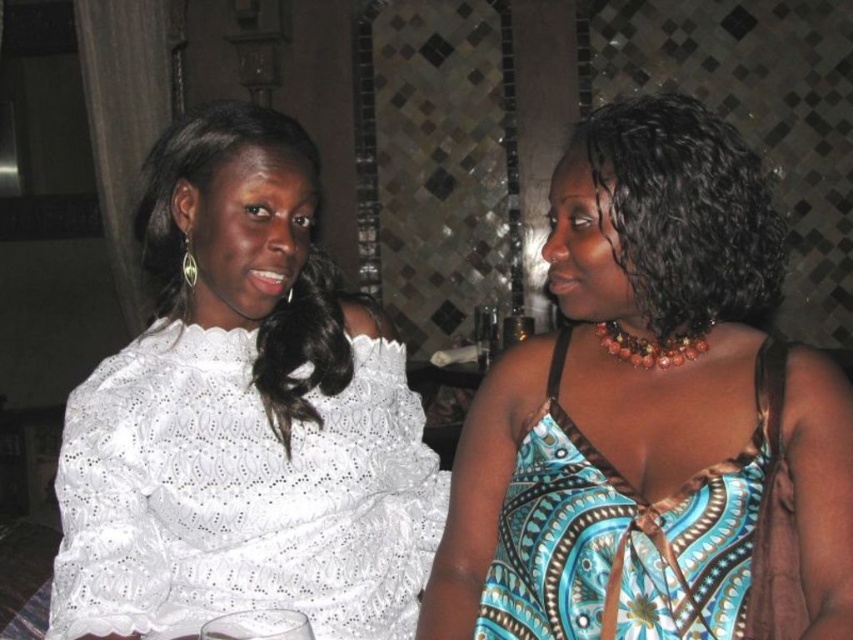
Between blue printed dress at center and blue printed fabric dress at right, which one appears on the right side from the viewer's perspective?

Positioned to the right is blue printed dress at center.

Which is in front, point (840, 632) or point (576, 600)?

Point (840, 632) is more forward.

The image size is (853, 640). In order to click on blue printed dress at center in this screenshot , I will do `click(653, 417)`.

Can you confirm if white lace dress at left is positioned below blue printed fabric dress at right?

Yes.

Is white lace dress at left to the right of blue printed fabric dress at right from the viewer's perspective?

In fact, white lace dress at left is to the left of blue printed fabric dress at right.

Does point (177, 371) come in front of point (640, 636)?

That is False.

The image size is (853, 640). What are the coordinates of `white lace dress at left` in the screenshot? It's located at (241, 493).

Which is below, white lace dress at left or white lace blouse at upper left?

white lace dress at left

Where is `white lace dress at left`? white lace dress at left is located at coordinates (241, 493).

Identify the location of white lace dress at left. (241, 493).